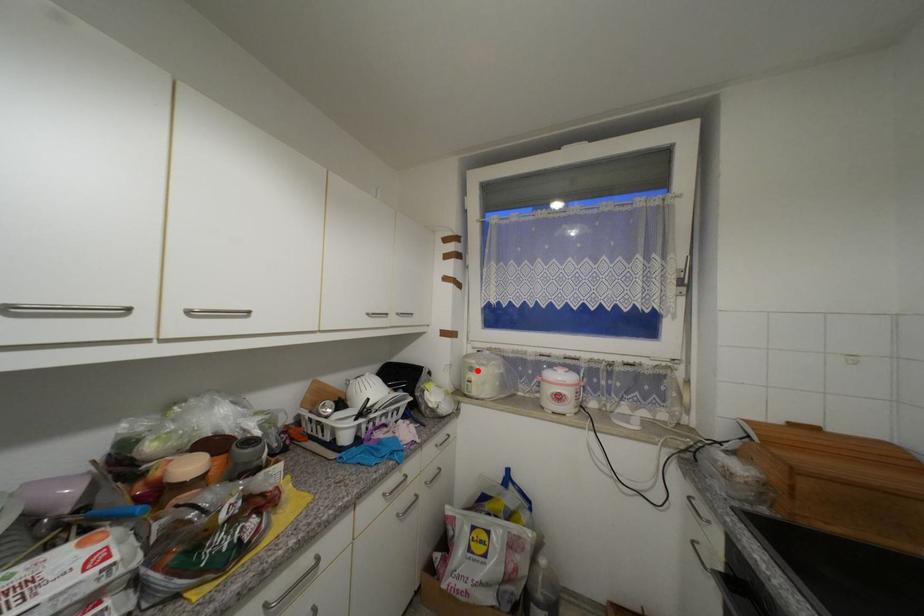
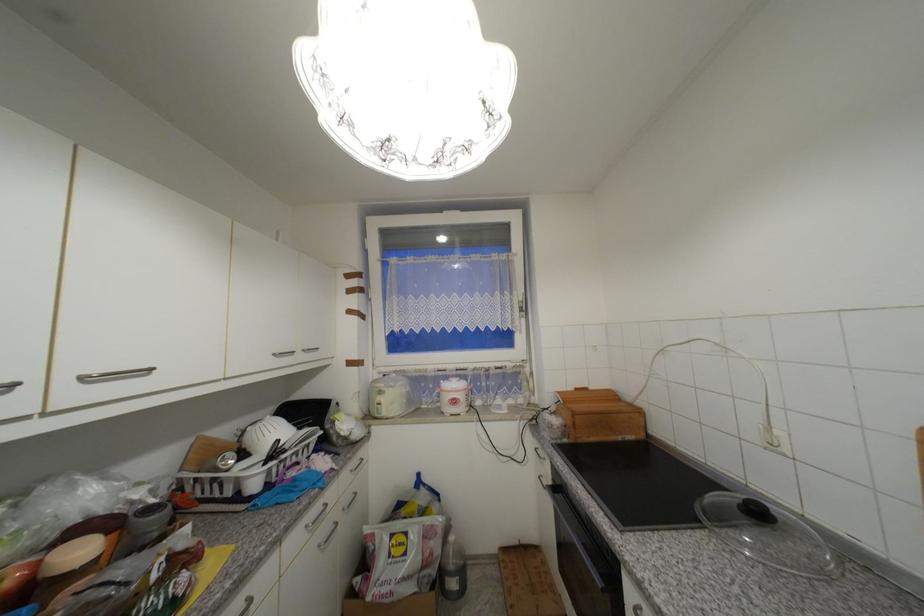
Locate, in the second image, the point that corresponds to the highlighted location in the first image.

(386, 394)